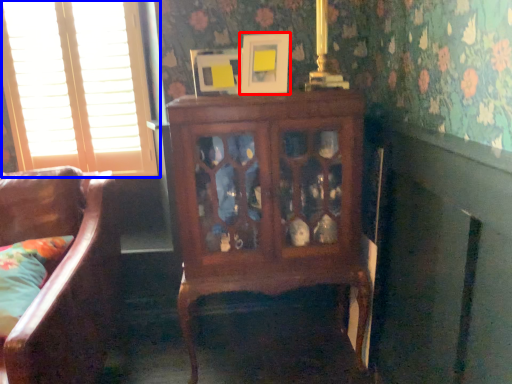
Question: Which of the following is the closest to the observer, picture frame (highlighted by a red box) or window (highlighted by a blue box)?

Choices:
 (A) picture frame
 (B) window

Answer: (A)